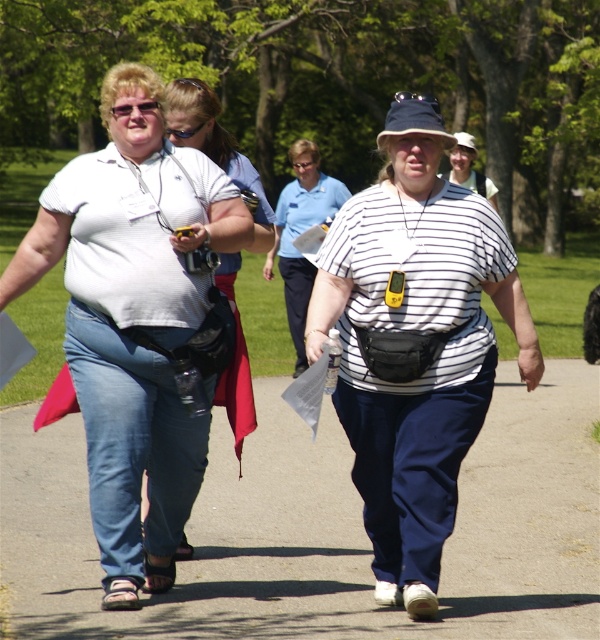
Question: Is blue denim pants at lower center positioned before matte white shirt at left?

Choices:
 (A) no
 (B) yes

Answer: (A)

Question: Where is white matte shirt at upper left located in relation to matte white shirt at left in the image?

Choices:
 (A) above
 (B) below

Answer: (A)

Question: Which of the following is the closest to the observer?

Choices:
 (A) (247, 413)
 (B) (448, 145)
 (C) (169, 468)
 (D) (175, 134)

Answer: (B)

Question: Which of the following is the closest to the observer?

Choices:
 (A) white matte shirt at upper left
 (B) navy blue fabric baseball hat at center
 (C) matte white shirt at left
 (D) white striped shirt at center

Answer: (D)

Question: Does blue denim pants at lower center have a smaller size compared to clear plastic goggles at upper center?

Choices:
 (A) no
 (B) yes

Answer: (A)

Question: Based on their relative distances, which object is nearer to the white striped shirt at center?

Choices:
 (A) blue denim pants at lower center
 (B) white matte shirt at upper left
 (C) navy blue fabric baseball hat at center
 (D) matte white shirt at left

Answer: (D)